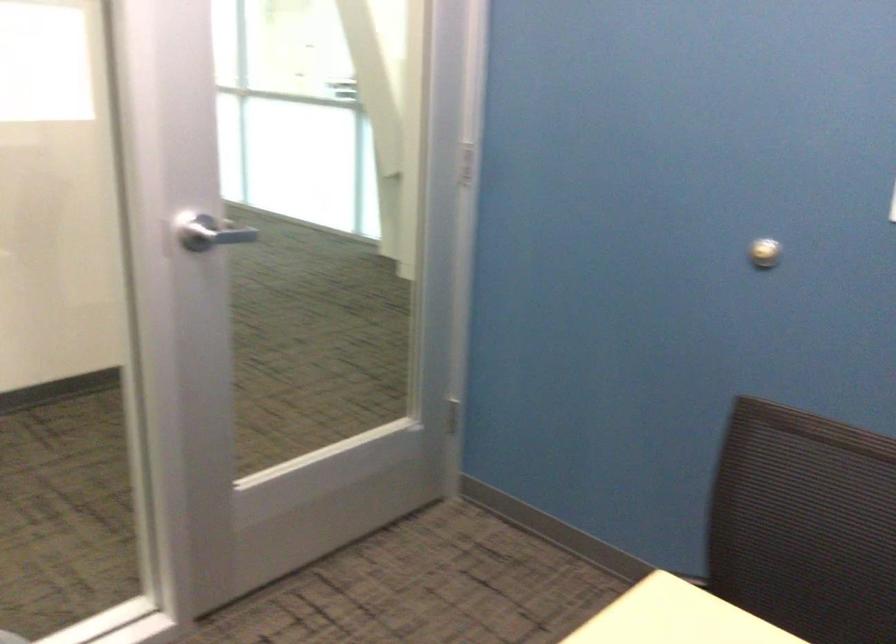
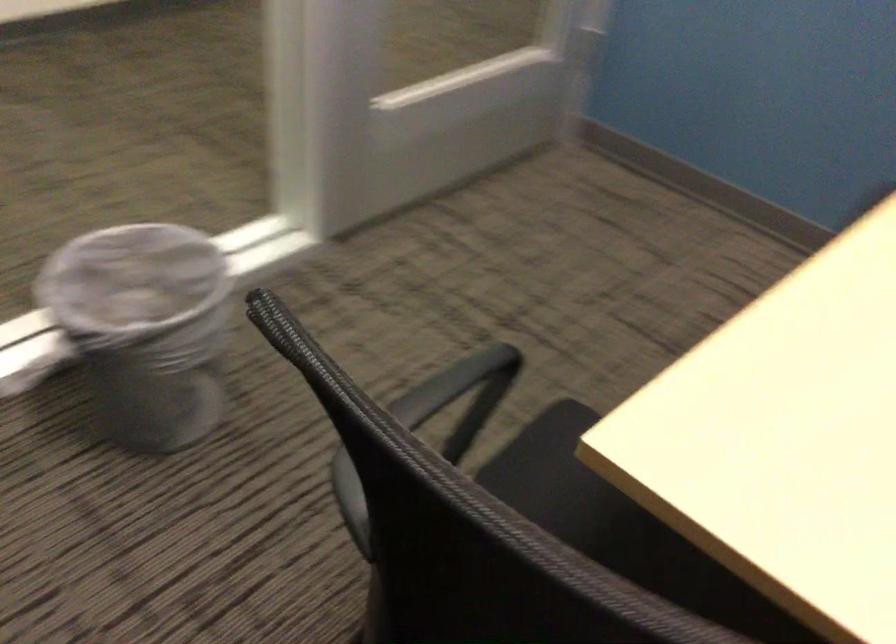
Question: Which direction would the cameraman need to move to produce the second image? Reply with the corresponding letter.

Choices:
 (A) Left
 (B) Right
 (C) Forward
 (D) Backward

Answer: (A)